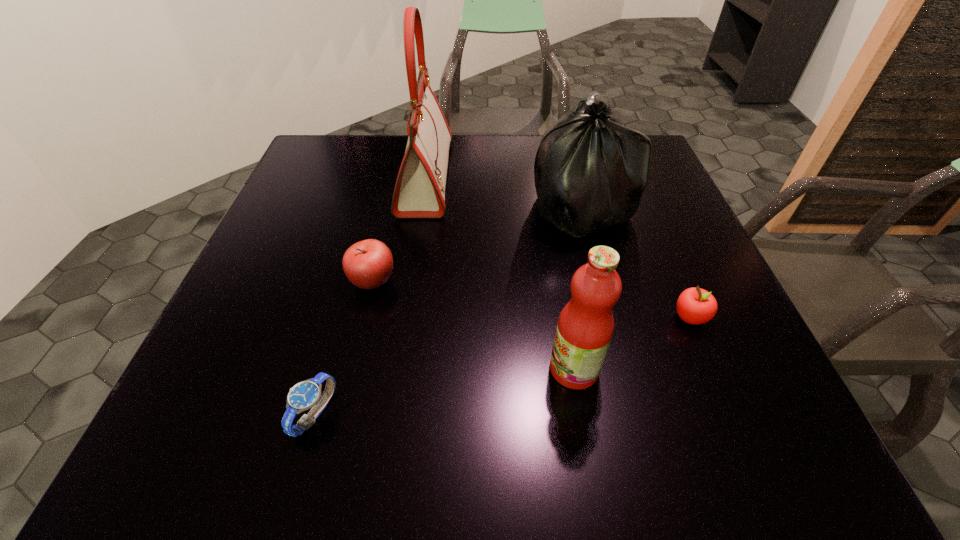
Where is `apple positioned at the right edge`? apple positioned at the right edge is located at coordinates (695, 306).

Identify the location of object that is at the far right corner. (590, 171).

In the image, there is a desktop. In order to click on free space at the far edge in this screenshot , I will do `click(490, 176)`.

The image size is (960, 540). In the image, there is a desktop. Identify the location of vacant space at the near edge. (623, 418).

Identify the location of free space at the left edge. The height and width of the screenshot is (540, 960). (268, 258).

Locate an element on the screen. The image size is (960, 540). vacant area at the right edge of the desktop is located at coordinates (635, 219).

The height and width of the screenshot is (540, 960). Find the location of `vacant region between the shortest object and the plastic bag`. vacant region between the shortest object and the plastic bag is located at coordinates [x=448, y=310].

I want to click on empty space that is in between the tallest object and the third farthest object, so click(399, 230).

This screenshot has width=960, height=540. Identify the location of free space between the plastic bag and the nearer apple. pos(636,262).

I want to click on unoccupied position between the tallest object and the fruit juice, so click(x=500, y=273).